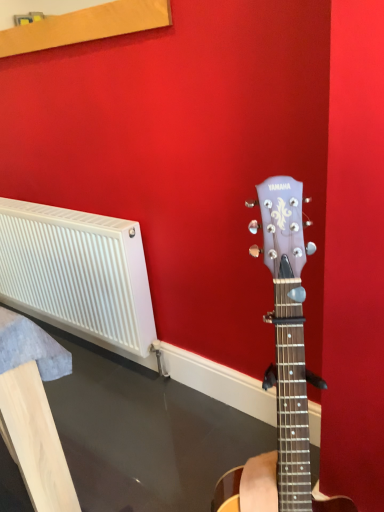
Where is `free location above white plastic radiator at left (from a real-world perspective)`? free location above white plastic radiator at left (from a real-world perspective) is located at coordinates (48, 207).